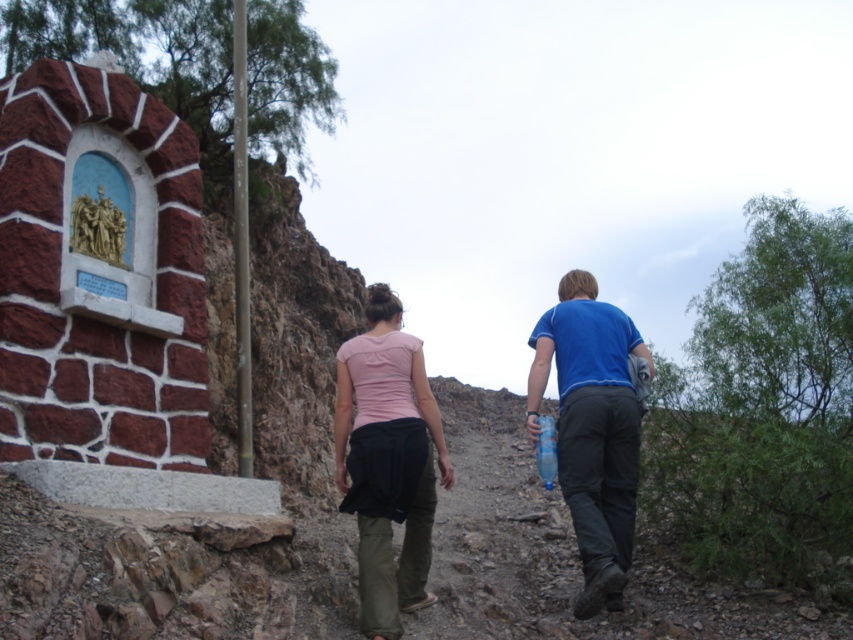
Question: Which point is farther to the camera?

Choices:
 (A) (581, 440)
 (B) (389, 525)
 (C) (606, 432)

Answer: (C)

Question: Which point is closer to the camera?

Choices:
 (A) (379, 380)
 (B) (589, 474)
 (C) (631, 388)

Answer: (B)

Question: In this image, where is pink fabric shirt at center located relative to pink fabric skirt at center?

Choices:
 (A) right
 (B) left

Answer: (A)

Question: Does pink fabric shirt at center have a lesser width compared to pink fabric skirt at center?

Choices:
 (A) no
 (B) yes

Answer: (A)

Question: Can you confirm if pink fabric shirt at center is bigger than pink fabric skirt at center?

Choices:
 (A) yes
 (B) no

Answer: (B)

Question: Which point appears closest to the camera in this image?

Choices:
 (A) (431, 465)
 (B) (631, 451)
 (C) (569, 352)

Answer: (B)